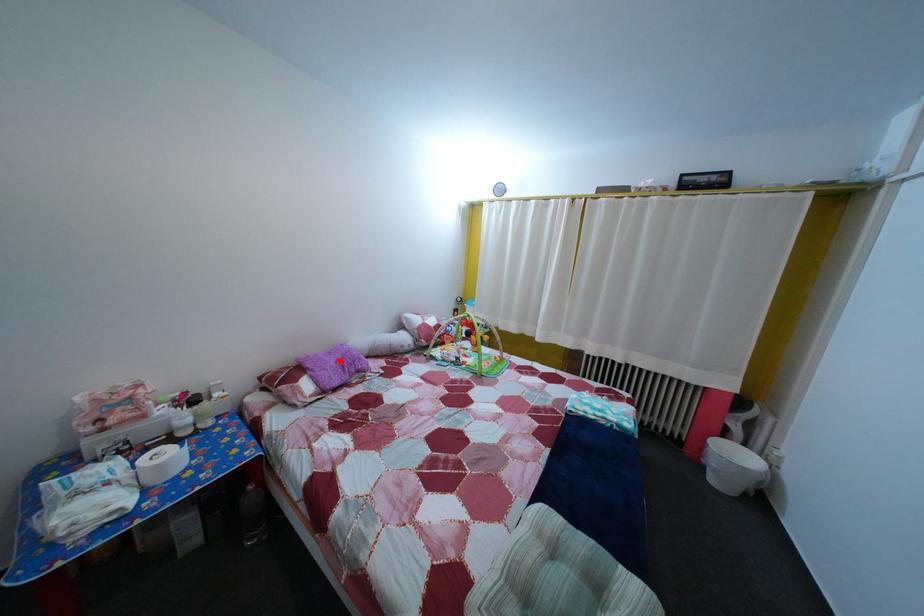
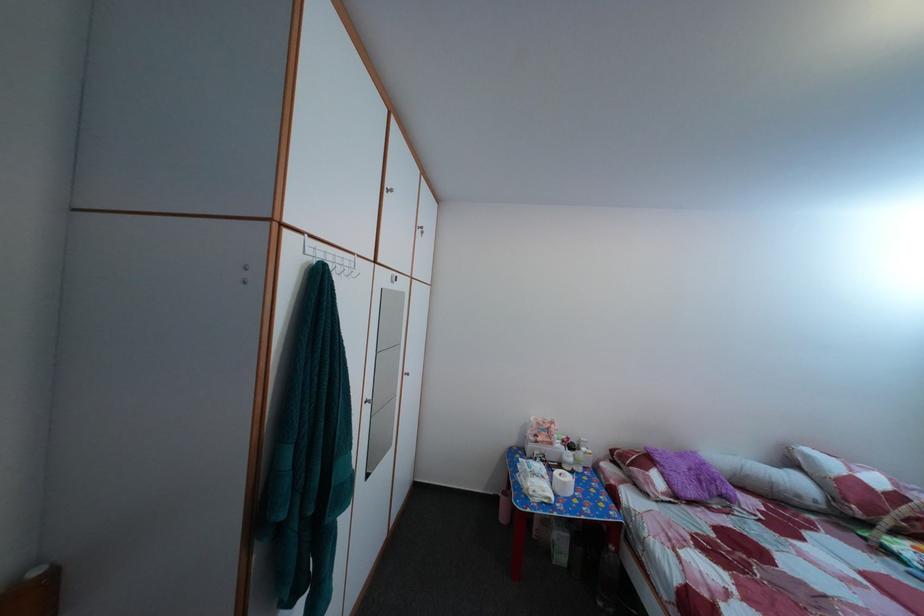
Find the pixel in the second image that matches the highlighted location in the first image.

(689, 464)